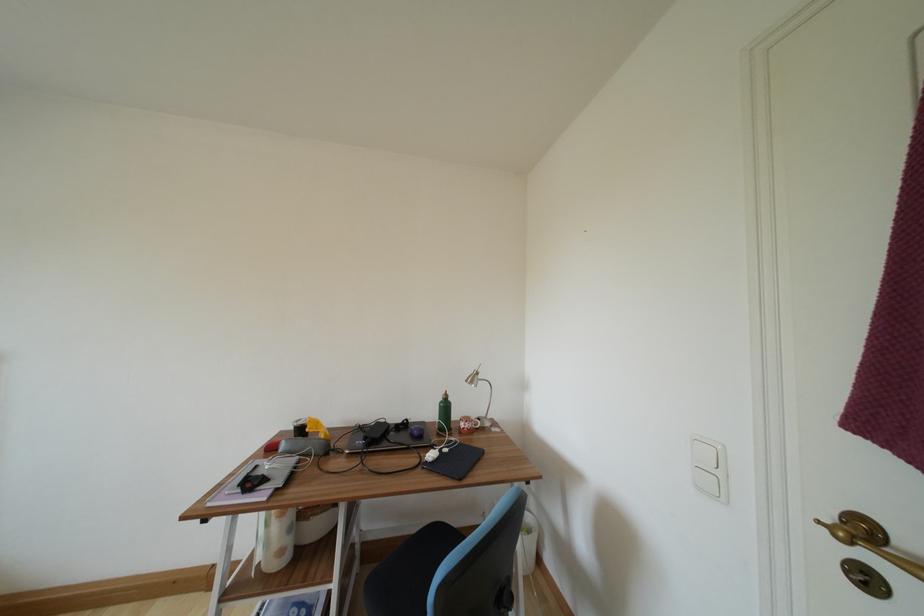
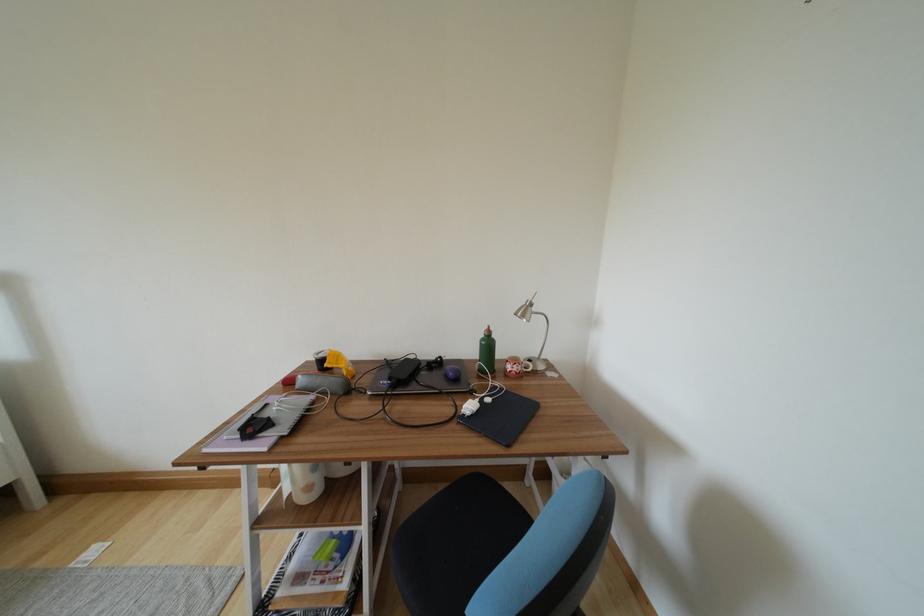
Question: In a continuous first-person perspective shot, in which direction is the camera moving?

Choices:
 (A) Left
 (B) Right
 (C) Forward
 (D) Backward

Answer: (C)